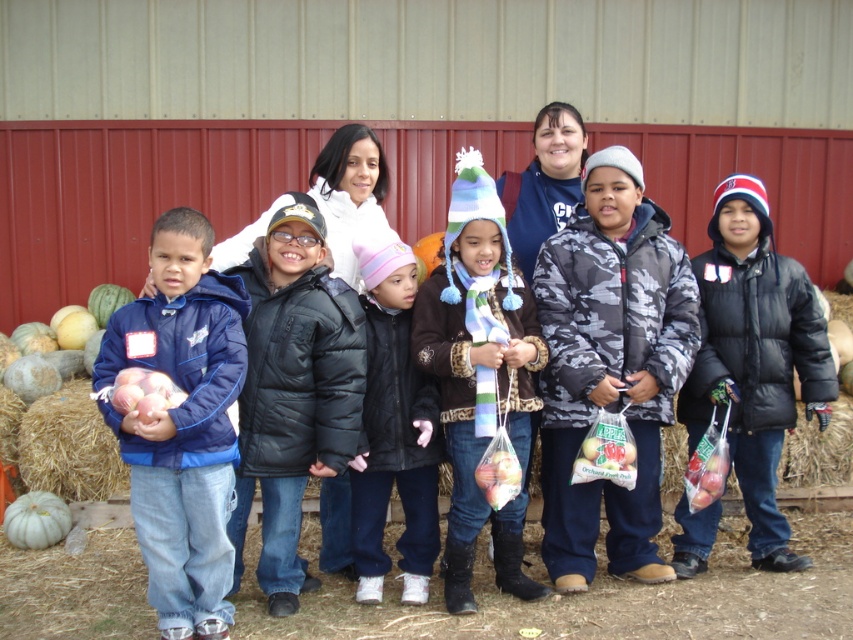
Does point (151, 458) come closer to viewer compared to point (746, 269)?

Yes, it is in front of point (746, 269).

Between blue fleece jacket at left and black puffy coat at center, which one appears on the right side from the viewer's perspective?

Positioned to the right is black puffy coat at center.

Looking at this image, measure the distance between point (167, 291) and camera.

Point (167, 291) is 4.74 meters from camera.

The width and height of the screenshot is (853, 640). Identify the location of blue fleece jacket at left. (183, 422).

Can you confirm if striped wool hat at center is positioned above brown straw bale at lower left?

Correct, striped wool hat at center is located above brown straw bale at lower left.

Which of these two, striped wool hat at center or brown straw bale at lower left, stands taller?

striped wool hat at center

Where is `striped wool hat at center`? striped wool hat at center is located at coordinates (479, 376).

This screenshot has height=640, width=853. What are the coordinates of `striped wool hat at center` in the screenshot? It's located at (479, 376).

Does camouflage jacket at center have a greater height compared to black quilted jacket at center?

Yes, camouflage jacket at center is taller than black quilted jacket at center.

Between camouflage jacket at center and black quilted jacket at center, which one appears on the left side from the viewer's perspective?

From the viewer's perspective, black quilted jacket at center appears more on the left side.

Between point (680, 260) and point (422, 477), which one is positioned behind?

Positioned behind is point (680, 260).

Image resolution: width=853 pixels, height=640 pixels. In order to click on camouflage jacket at center in this screenshot , I will do `click(610, 365)`.